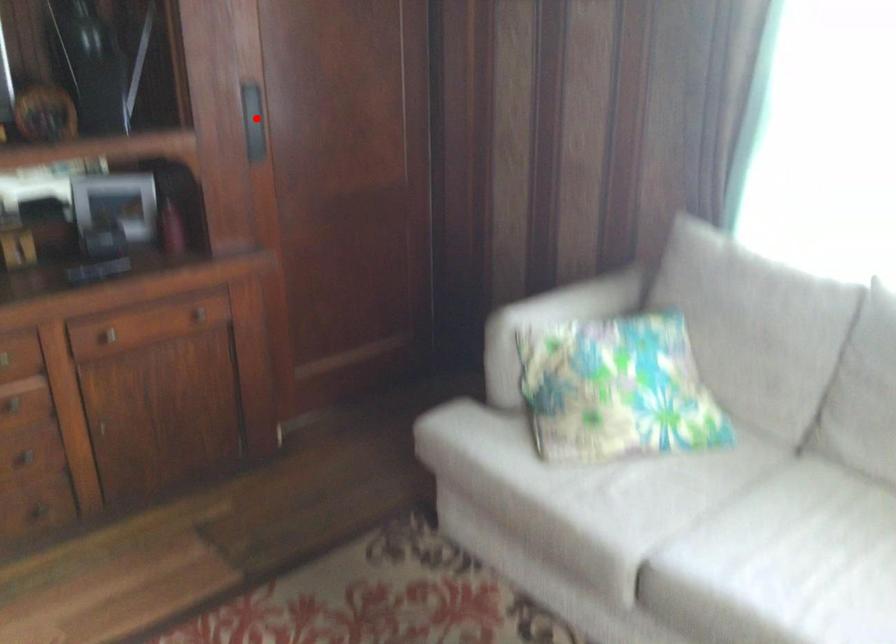
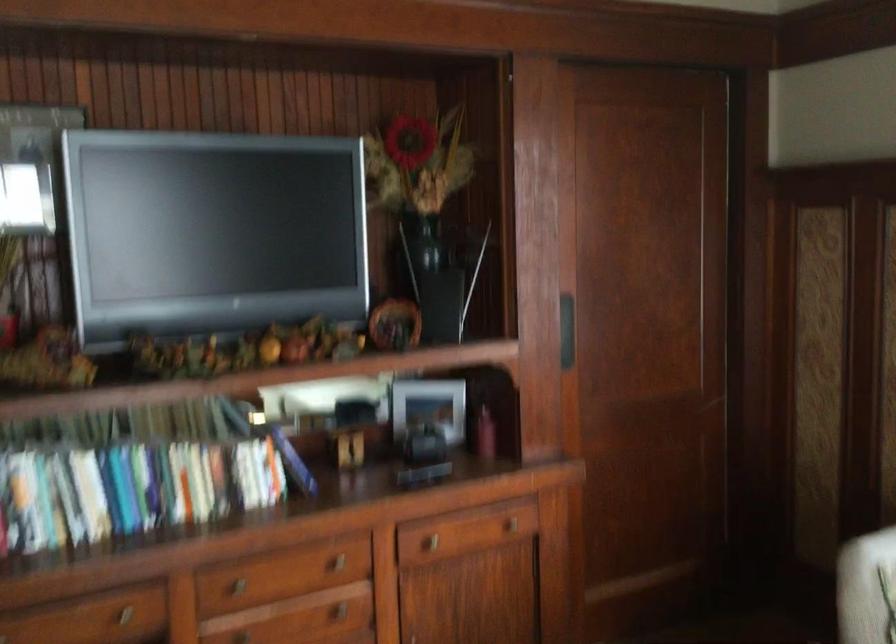
Locate, in the second image, the point that corresponds to the highlighted location in the first image.

(565, 330)